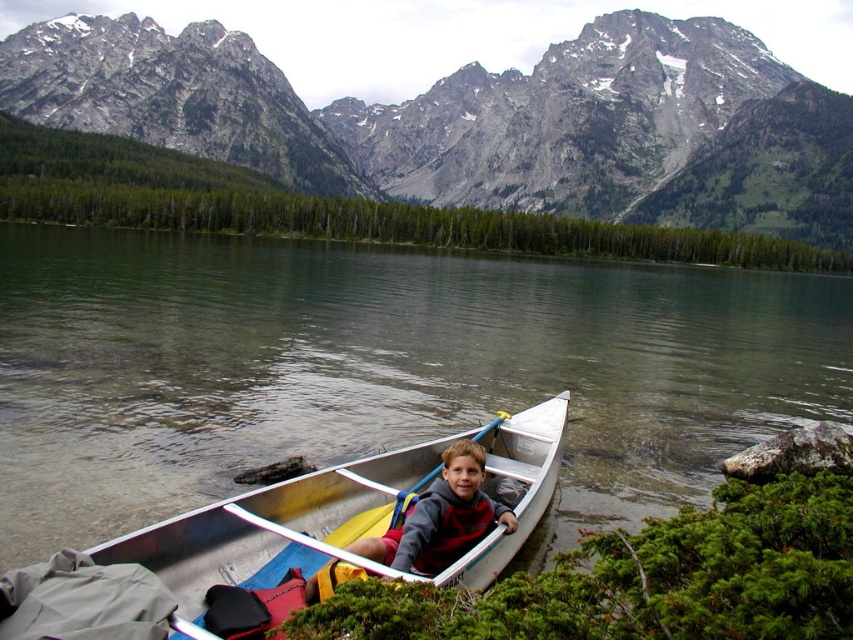
Find the location of `gray rocky mountain at upper center`. gray rocky mountain at upper center is located at coordinates (480, 122).

Is point (77, 58) less distant than point (230, 608)?

That is False.

The image size is (853, 640). I want to click on gray rocky mountain at upper center, so click(480, 122).

Which is below, silver metallic canoe at center or yellow plastic paddle at center?

silver metallic canoe at center is below.

Which is behind, point (466, 474) or point (334, 540)?

The point (466, 474) is behind.

Where is `silver metallic canoe at center`? This screenshot has height=640, width=853. silver metallic canoe at center is located at coordinates (300, 540).

Does gray rocky mountain at upper center lie in front of yellow plastic paddle at center?

No, it is not.

Does gray rocky mountain at upper center lie behind yellow plastic paddle at center?

Yes, it is behind yellow plastic paddle at center.

Who is more forward, (202,154) or (476,433)?

Point (476,433)

The image size is (853, 640). In order to click on gray rocky mountain at upper center in this screenshot , I will do `click(480, 122)`.